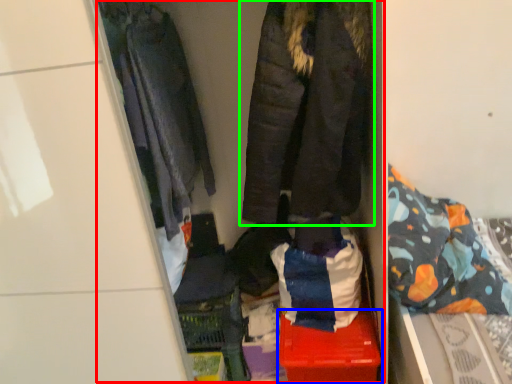
Question: Considering the real-world distances, which object is closest to closet (highlighted by a red box)? storage box (highlighted by a blue box) or jacket (highlighted by a green box).

Choices:
 (A) storage box
 (B) jacket

Answer: (B)